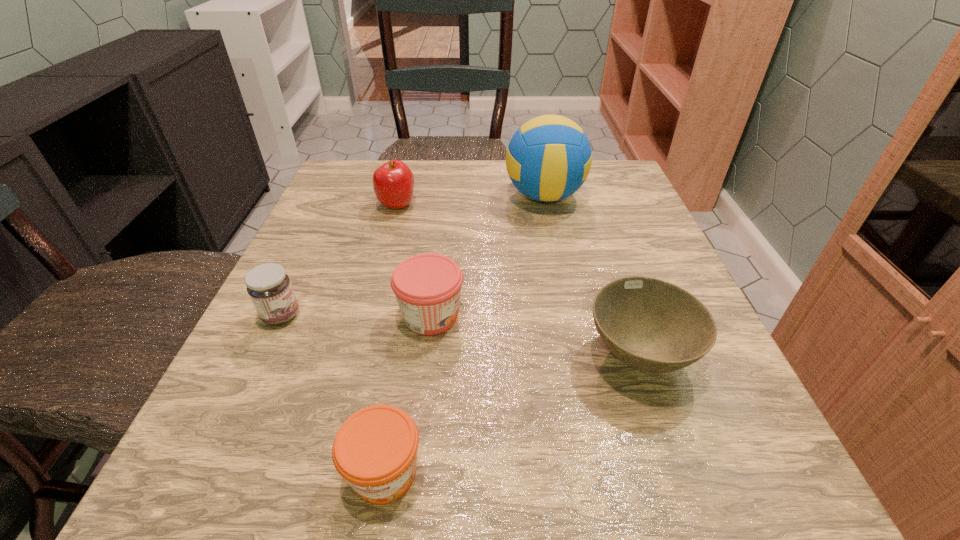
I want to click on unoccupied position between the nearest object and the leftmost jam, so click(333, 394).

The width and height of the screenshot is (960, 540). What are the coordinates of `empty location between the bowl and the apple` in the screenshot? It's located at (517, 280).

I want to click on object that stands as the second closest to the leftmost jam, so click(x=375, y=450).

Select which object is the third closest to the leftmost jam. Please provide its 2D coordinates. Your answer should be formatted as a tuple, i.e. [(x, y)], where the tuple contains the x and y coordinates of a point satisfying the conditions above.

[(393, 182)]

Image resolution: width=960 pixels, height=540 pixels. Find the location of `jam that stands as the second closest to the leftmost jam`. jam that stands as the second closest to the leftmost jam is located at coordinates (375, 450).

You are a GUI agent. You are given a task and a screenshot of the screen. Output one action in this format:
    pyautogui.click(x=<x>, y=<y>)
    Task: Click on the jam that stands as the closest to the bowl
    
    Given the screenshot: What is the action you would take?
    pyautogui.click(x=427, y=286)

The height and width of the screenshot is (540, 960). In order to click on vacant space that satisfies the following two spatial constraints: 1. on the back side of the tallest object; 2. on the left side of the second tallest object in this screenshot , I will do `click(399, 196)`.

Locate an element on the screen. free region that satisfies the following two spatial constraints: 1. on the front label of the leftmost object; 2. on the left side of the bowl is located at coordinates (262, 355).